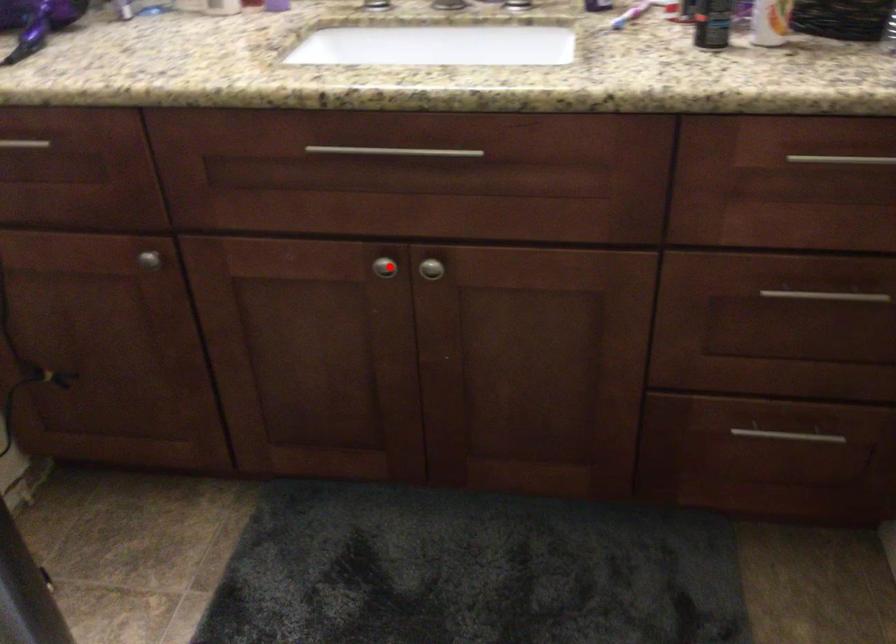
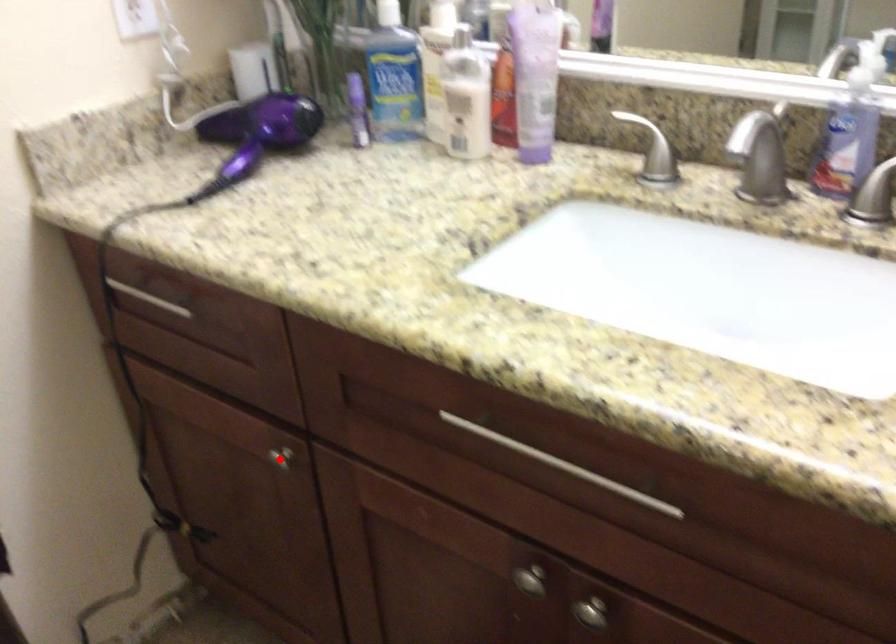
I am providing you with two images of the same scene from different viewpoints. A red point is marked on the first image and another point is marked on the second image. Is the red point in image1 aligned with the point shown in image2?

No